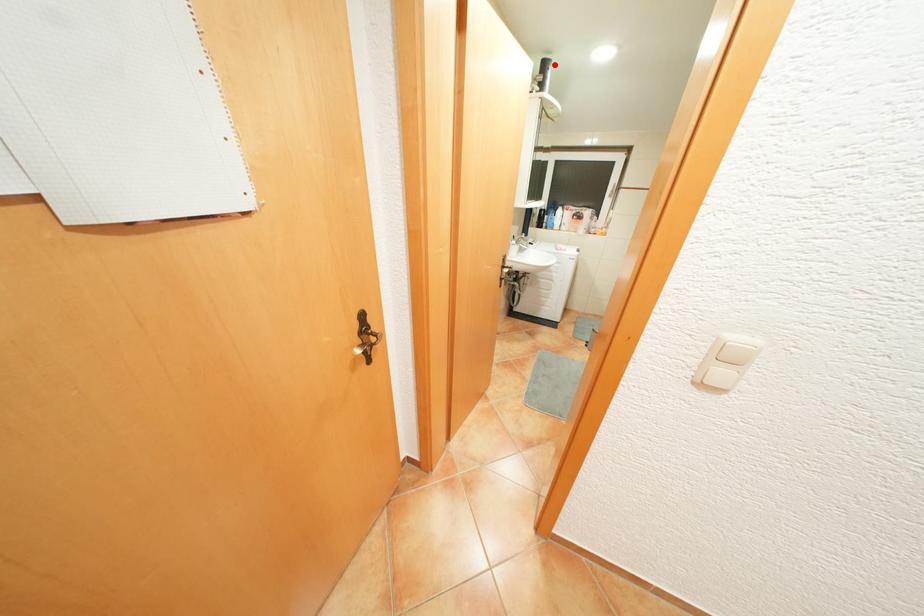
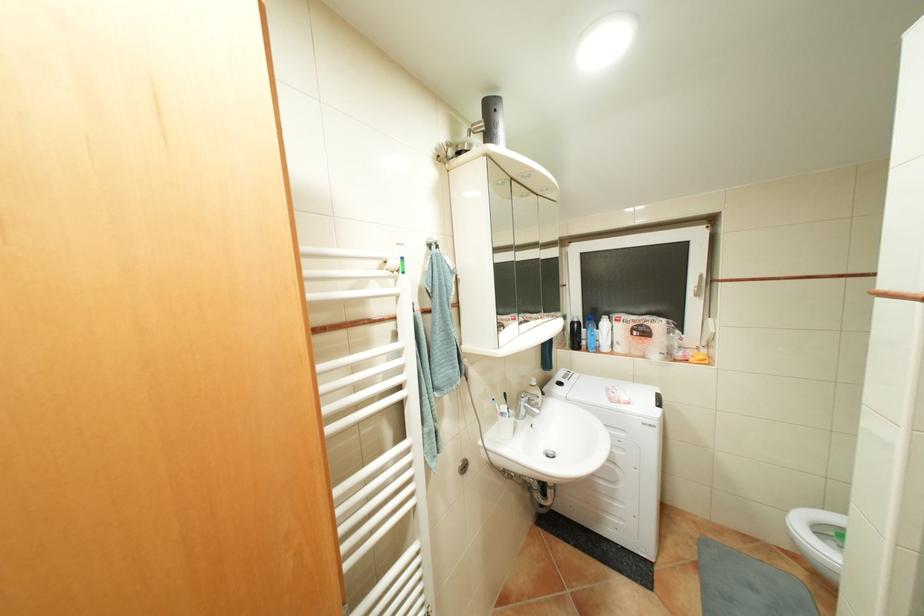
Locate, in the second image, the point that corresponds to the highlighted location in the first image.

(499, 108)